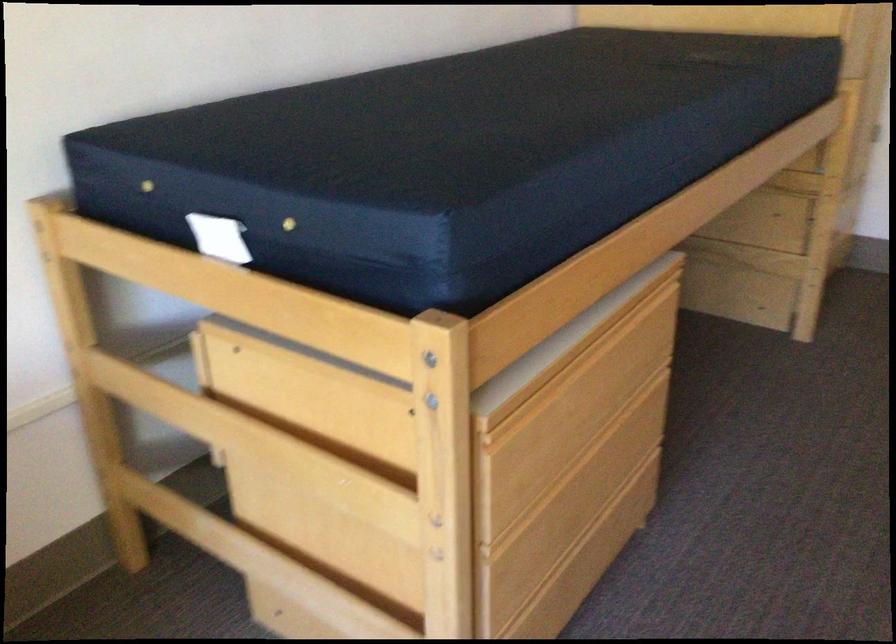
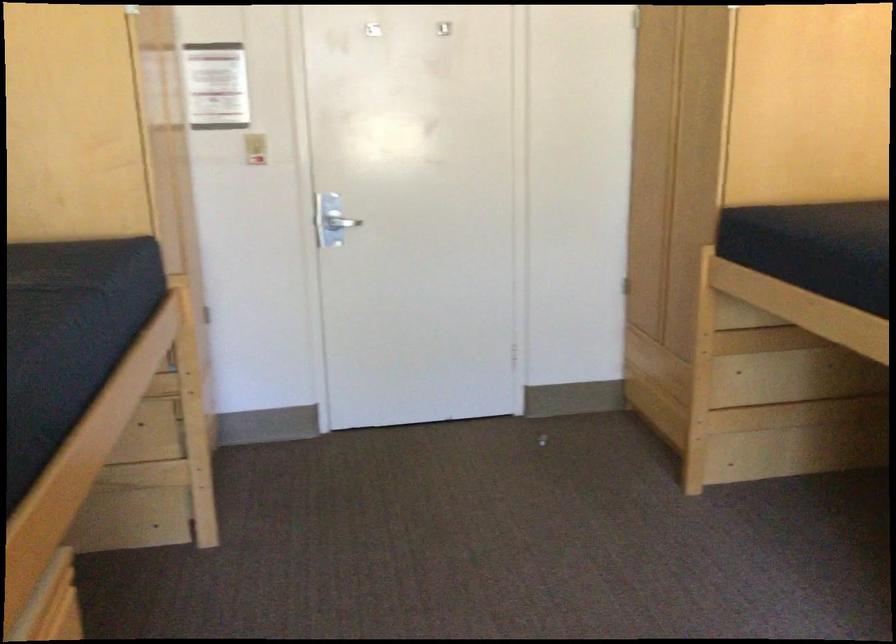
Question: The camera is either moving clockwise (left) or counter-clockwise (right) around the object. The first image is from the beginning of the video and the second image is from the end. Is the camera moving left or right when shooting the video?

Choices:
 (A) Left
 (B) Right

Answer: (A)